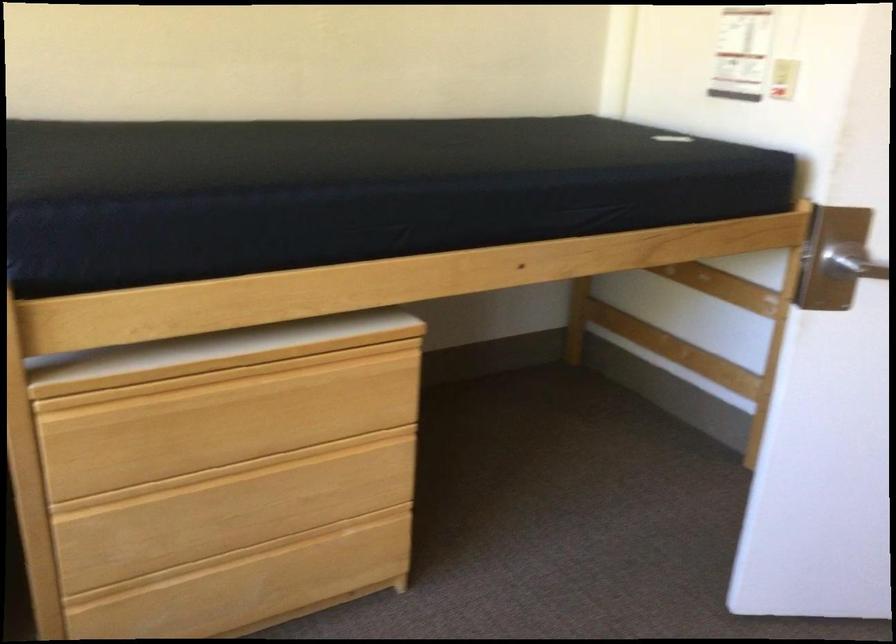
Where would you flip the light switch? Please return your answer as a coordinate pair (x, y).

(784, 71)